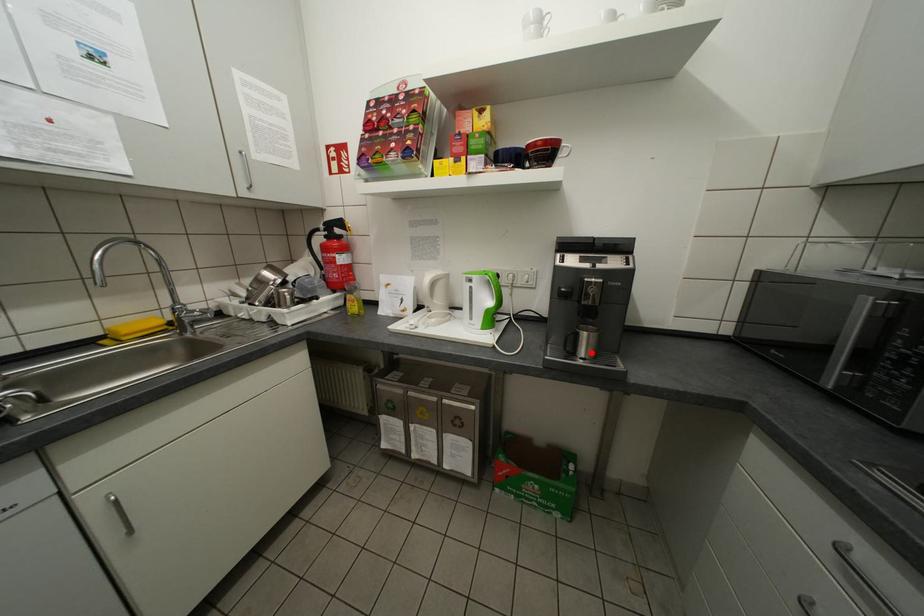
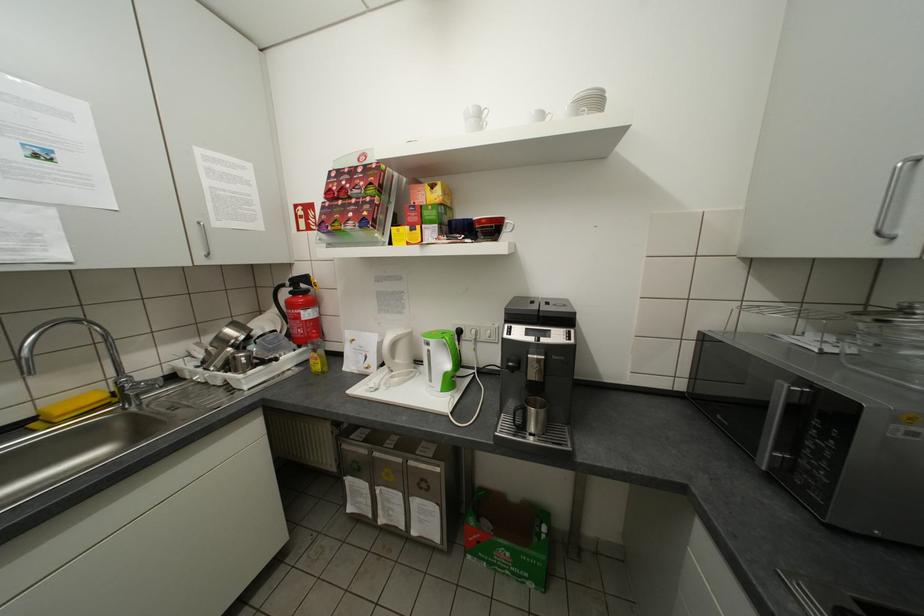
Locate, in the second image, the point that corresponds to the highlighted location in the first image.

(541, 428)